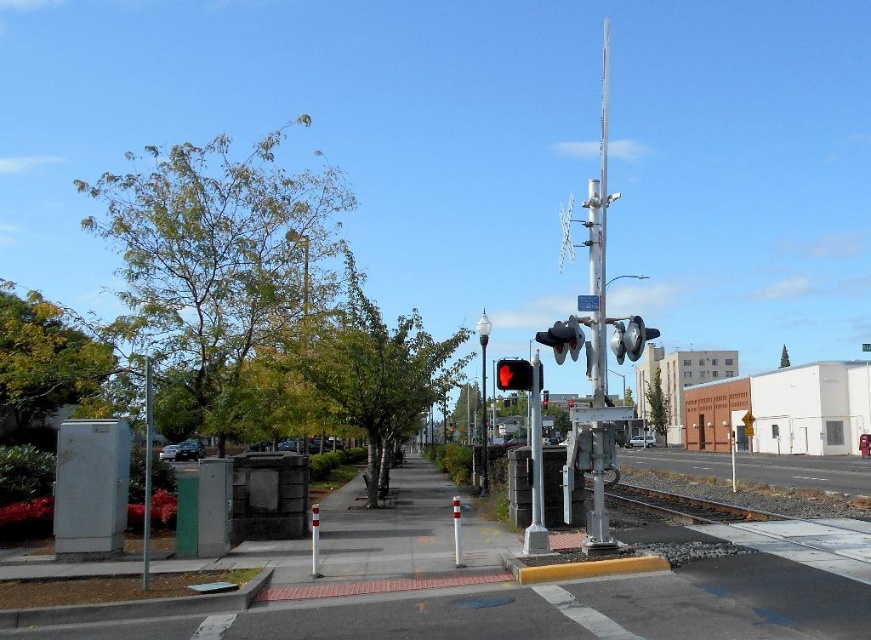
Question: Which is nearer to the silver metallic pole at right?

Choices:
 (A) green textured utility pole at left
 (B) red matte traffic light at center

Answer: (A)

Question: Is silver metallic pole at right to the right of red matte traffic light at center from the viewer's perspective?

Choices:
 (A) no
 (B) yes

Answer: (B)

Question: Does green textured utility pole at left have a lesser width compared to red matte traffic light at center?

Choices:
 (A) no
 (B) yes

Answer: (A)

Question: Estimate the real-world distances between objects in this image. Which object is farther from the silver metallic pole at right?

Choices:
 (A) green textured utility pole at left
 (B) red matte traffic light at center

Answer: (B)

Question: Does green textured utility pole at left come in front of red matte traffic light at center?

Choices:
 (A) yes
 (B) no

Answer: (A)

Question: Which of the following is the closest to the observer?

Choices:
 (A) (147, 579)
 (B) (599, 352)

Answer: (A)